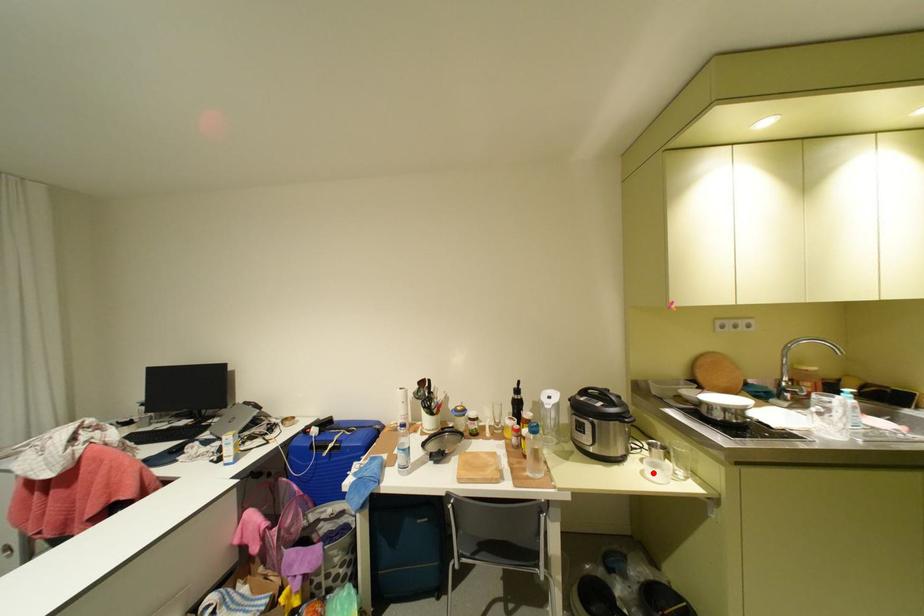
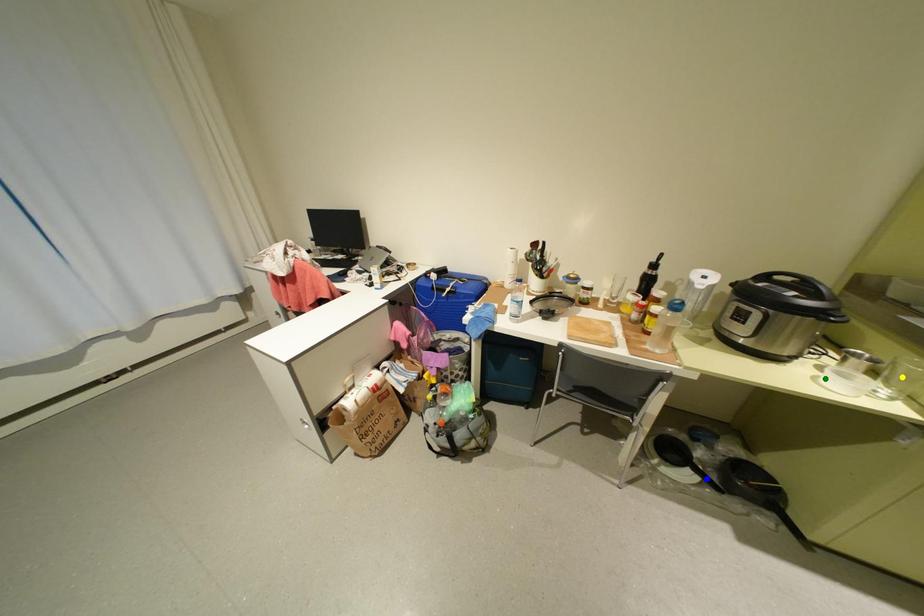
Question: I am providing you with two images of the same scene from different viewpoints. A red point is marked on the first image. You are given multiple points on the second image. In image 2, which mark is for the same physical point as the one in image 1?

Choices:
 (A) blue point
 (B) green point
 (C) yellow point

Answer: (B)